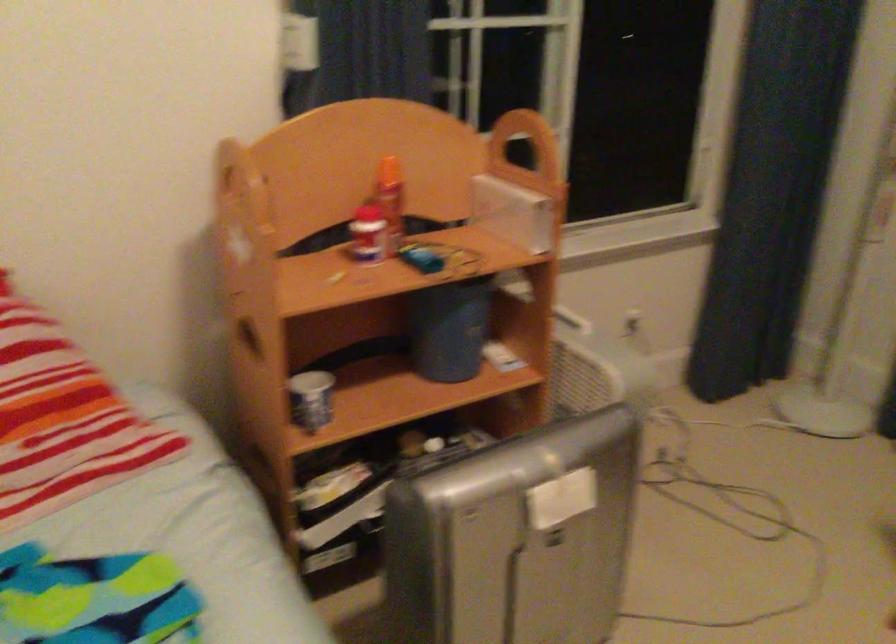
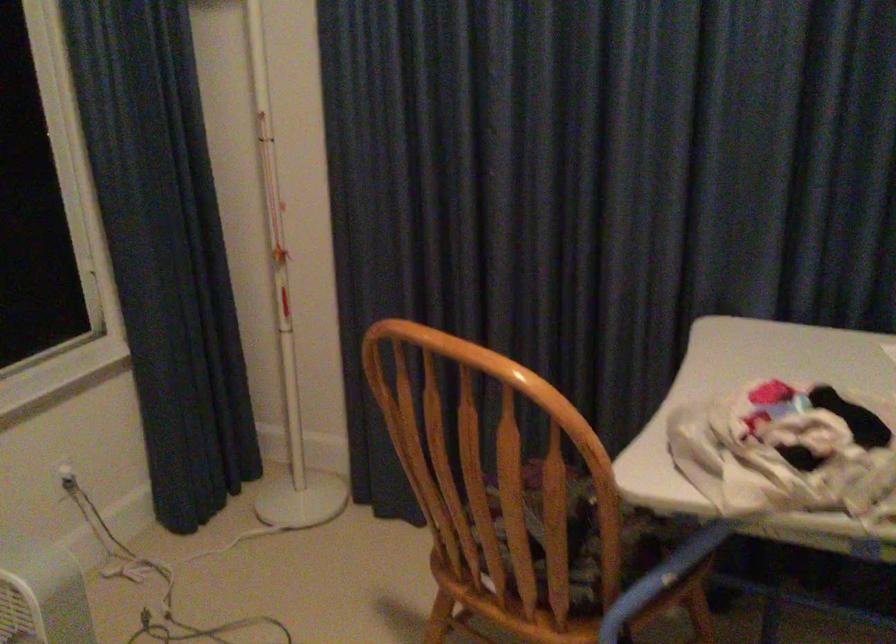
Question: The images are taken continuously from a first-person perspective. In which direction is your viewpoint rotating?

Choices:
 (A) Left
 (B) Right
 (C) Up
 (D) Down

Answer: (B)